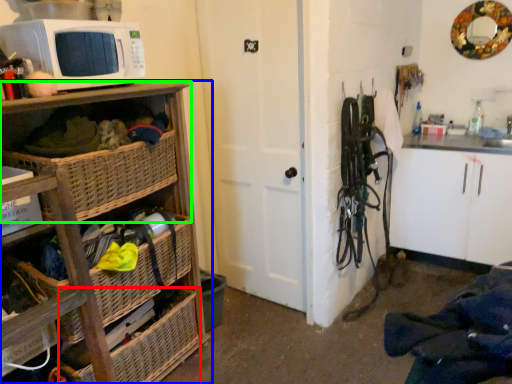
Question: Which object is the farthest from basket (highlighted by a red box)? Choose among these: cabinetry (highlighted by a blue box) or shelf (highlighted by a green box).

Choices:
 (A) cabinetry
 (B) shelf

Answer: (B)